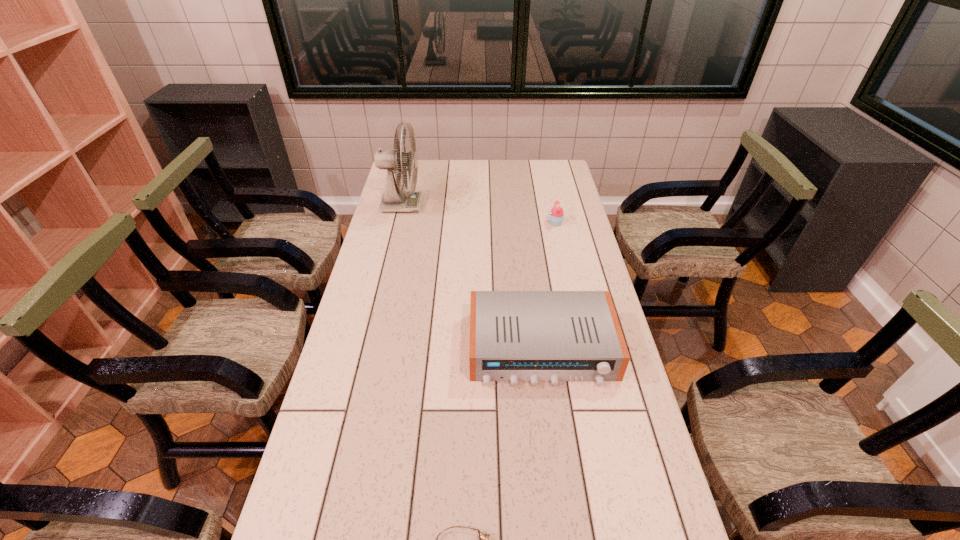
Find the location of a particular element. radio receiver located in the right edge section of the desktop is located at coordinates (534, 336).

Locate an element on the screen. The width and height of the screenshot is (960, 540). cupcake situated at the right edge is located at coordinates (556, 217).

In the image, there is a desktop. Identify the location of free space at the far edge. The width and height of the screenshot is (960, 540). [x=475, y=184].

In the image, there is a desktop. What are the coordinates of `vacant space at the left edge` in the screenshot? It's located at (363, 269).

What are the coordinates of `vacant space at the far right corner of the desktop` in the screenshot? It's located at (559, 169).

You are a GUI agent. You are given a task and a screenshot of the screen. Output one action in this format:
    pyautogui.click(x=<x>, y=<y>)
    Task: Click on the empty space between the leftmost object and the cupcake
    This screenshot has height=540, width=960.
    Given the screenshot: What is the action you would take?
    pyautogui.click(x=479, y=214)

Identify the location of free spot between the cupcake and the radio receiver. The image size is (960, 540). (549, 286).

Identify the location of free spot between the second nearest object and the cupcake. (549, 286).

This screenshot has width=960, height=540. Identify the location of free area in between the cupcake and the third farthest object. (549, 286).

Locate an element on the screen. The width and height of the screenshot is (960, 540). free spot between the cupcake and the third farthest object is located at coordinates click(x=549, y=286).